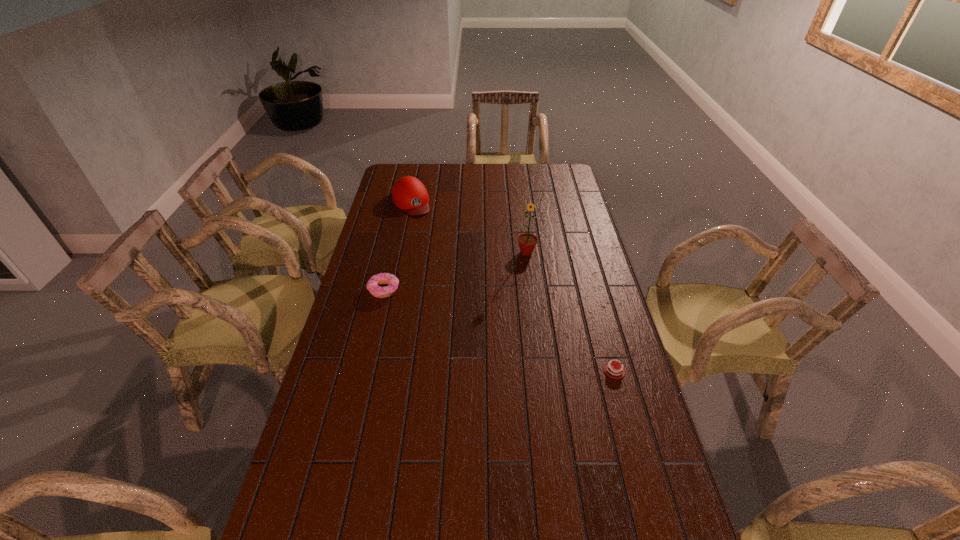
This screenshot has height=540, width=960. In the image, there is a desktop. Identify the location of free space at the near edge. pyautogui.click(x=448, y=530).

Where is `vacant space at the left edge of the desktop`? The image size is (960, 540). vacant space at the left edge of the desktop is located at coordinates (399, 211).

Locate an element on the screen. This screenshot has width=960, height=540. blank space at the right edge is located at coordinates pyautogui.click(x=568, y=302).

You are a GUI agent. You are given a task and a screenshot of the screen. Output one action in this format:
    pyautogui.click(x=<x>, y=<y>)
    Task: Click on the free region at the far left corner of the desktop
    The image size is (960, 540).
    Given the screenshot: What is the action you would take?
    pyautogui.click(x=409, y=169)

The width and height of the screenshot is (960, 540). I want to click on free spot between the chocolate cake and the third tallest object, so click(499, 330).

You are a GUI agent. You are given a task and a screenshot of the screen. Output one action in this format:
    pyautogui.click(x=<x>, y=<y>)
    Task: Click on the vacant area that lies between the second nearest object and the second object from right to left
    
    Given the screenshot: What is the action you would take?
    pyautogui.click(x=455, y=271)

Identify the location of free space that is in between the second tallest object and the second shortest object. The image size is (960, 540). coord(397,246).

The image size is (960, 540). What are the coordinates of `empty space that is in between the rightmost object and the doughnut` in the screenshot? It's located at (499, 330).

Where is `vacant space that is in between the farthest object and the chocolate cake`? The image size is (960, 540). vacant space that is in between the farthest object and the chocolate cake is located at coordinates (513, 286).

Image resolution: width=960 pixels, height=540 pixels. Find the location of `free space between the third farthest object and the tallest object`. free space between the third farthest object and the tallest object is located at coordinates (455, 271).